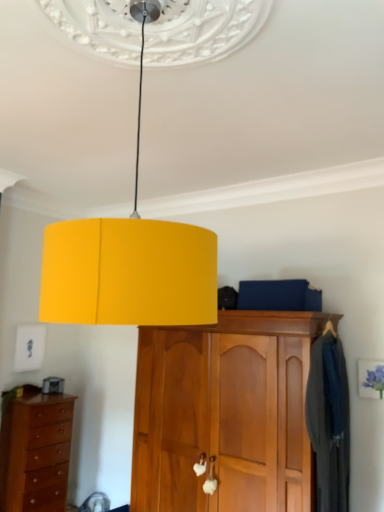
Identify the location of wooden cabinet at center. The image size is (384, 512). (225, 413).

This screenshot has height=512, width=384. Identify the location of brown wooden chest of drawers at lower left. (36, 453).

Looking at this image, which point is more forward, (338, 341) or (52, 445)?

The point (338, 341) is closer.

Is dark blue fabric coat at right oriented away from brown wooden chest of drawers at lower left?

Yes.

Is dark blue fabric coat at right wider than brown wooden chest of drawers at lower left?

No, dark blue fabric coat at right is not wider than brown wooden chest of drawers at lower left.

Consider the image. Are wooden cabinet at center and dark blue fabric coat at right beside each other?

No, wooden cabinet at center is not touching dark blue fabric coat at right.

From the image's perspective, which is above, wooden cabinet at center or dark blue fabric coat at right?

dark blue fabric coat at right.

Identify the location of cabinetry that is on the left side of dark blue fabric coat at right. The height and width of the screenshot is (512, 384). (225, 413).

Does wooden cabinet at center have a greater height compared to dark blue fabric coat at right?

Yes, wooden cabinet at center is taller than dark blue fabric coat at right.

Is wooden cabinet at center further to camera compared to brown wooden chest of drawers at lower left?

No.

Is wooden cabinet at center to the left of brown wooden chest of drawers at lower left from the viewer's perspective?

In fact, wooden cabinet at center is to the right of brown wooden chest of drawers at lower left.

Where is `chest of drawers on the left side of wooden cabinet at center`? The width and height of the screenshot is (384, 512). chest of drawers on the left side of wooden cabinet at center is located at coordinates (36, 453).

From a real-world perspective, is wooden cabinet at center over brown wooden chest of drawers at lower left?

Yes, from a real-world perspective, wooden cabinet at center is above brown wooden chest of drawers at lower left.

Can you confirm if yellow matte lampshade at center is wider than brown wooden chest of drawers at lower left?

Yes, yellow matte lampshade at center is wider than brown wooden chest of drawers at lower left.

Identify the location of the chest of drawers that is under the yellow matte lampshade at center (from a real-world perspective). (36, 453).

Does yellow matte lampshade at center lie behind brown wooden chest of drawers at lower left?

No, it is not.

Considering the points (88, 263) and (279, 390), which point is in front, point (88, 263) or point (279, 390)?

Point (88, 263)

At what (x,y) coordinates should I click in order to perform the action: click on lamp located above the wooden cabinet at center (from a real-world perspective). Please return your answer as a coordinate pair (x, y). The height and width of the screenshot is (512, 384). Looking at the image, I should click on (129, 265).

Is yellow matte lampshade at center wider or thinner than wooden cabinet at center?

In the image, yellow matte lampshade at center appears to be wider than wooden cabinet at center.

Considering the positions of objects yellow matte lampshade at center and wooden cabinet at center in the image provided, who is more to the left, yellow matte lampshade at center or wooden cabinet at center?

From the viewer's perspective, yellow matte lampshade at center appears more on the left side.

Is brown wooden chest of drawers at lower left situated inside yellow matte lampshade at center or outside?

The correct answer is: outside.

Is brown wooden chest of drawers at lower left touching yellow matte lampshade at center?

brown wooden chest of drawers at lower left is not next to yellow matte lampshade at center, and they're not touching.

Between brown wooden chest of drawers at lower left and yellow matte lampshade at center, which one has larger width?

yellow matte lampshade at center is wider.

Does point (29, 433) lie behind point (94, 301)?

That is True.

How far apart are brown wooden chest of drawers at lower left and dark blue fabric coat at right?

The distance of brown wooden chest of drawers at lower left from dark blue fabric coat at right is 7.59 feet.

Would you say dark blue fabric coat at right is part of brown wooden chest of drawers at lower left's contents?

No, dark blue fabric coat at right is not surrounded by brown wooden chest of drawers at lower left.

Considering the sizes of objects brown wooden chest of drawers at lower left and dark blue fabric coat at right in the image provided, who is taller, brown wooden chest of drawers at lower left or dark blue fabric coat at right?

Standing taller between the two is dark blue fabric coat at right.

Is there a large distance between brown wooden chest of drawers at lower left and dark blue fabric coat at right?

Absolutely, brown wooden chest of drawers at lower left is distant from dark blue fabric coat at right.

Identify the location of chest of drawers behind the dark blue fabric coat at right. This screenshot has width=384, height=512. (36, 453).

Where is `cabinetry on the left of dark blue fabric coat at right`? cabinetry on the left of dark blue fabric coat at right is located at coordinates (225, 413).

Which object lies nearer to the anchor point dark blue fabric coat at right, brown wooden chest of drawers at lower left or wooden cabinet at center?

wooden cabinet at center is positioned closer to the anchor dark blue fabric coat at right.

Considering their positions, is brown wooden chest of drawers at lower left positioned further to dark blue fabric coat at right than yellow matte lampshade at center?

brown wooden chest of drawers at lower left.

Based on their spatial positions, is wooden cabinet at center or dark blue fabric coat at right further from yellow matte lampshade at center?

wooden cabinet at center.

When comparing their distances from wooden cabinet at center, does dark blue fabric coat at right or yellow matte lampshade at center seem further?

yellow matte lampshade at center.

Looking at the image, which one is located further to dark blue fabric coat at right, wooden cabinet at center or yellow matte lampshade at center?

yellow matte lampshade at center is positioned further to the anchor dark blue fabric coat at right.

From the image, which object appears to be nearer to yellow matte lampshade at center, brown wooden chest of drawers at lower left or wooden cabinet at center?

wooden cabinet at center lies closer to yellow matte lampshade at center than the other object.

Based on their spatial positions, is brown wooden chest of drawers at lower left or dark blue fabric coat at right further from yellow matte lampshade at center?

Based on the image, brown wooden chest of drawers at lower left appears to be further to yellow matte lampshade at center.

Looking at the image, which one is located further to yellow matte lampshade at center, wooden cabinet at center or brown wooden chest of drawers at lower left?

The object further to yellow matte lampshade at center is brown wooden chest of drawers at lower left.

Image resolution: width=384 pixels, height=512 pixels. I want to click on cabinetry located between yellow matte lampshade at center and dark blue fabric coat at right in the depth direction, so coord(225,413).

What are the coordinates of `clothing located between yellow matte lampshade at center and brown wooden chest of drawers at lower left in the depth direction` in the screenshot? It's located at (329, 422).

The width and height of the screenshot is (384, 512). I want to click on cabinetry between yellow matte lampshade at center and brown wooden chest of drawers at lower left along the z-axis, so click(x=225, y=413).

Locate an element on the screen. The height and width of the screenshot is (512, 384). cabinetry between brown wooden chest of drawers at lower left and dark blue fabric coat at right from left to right is located at coordinates tap(225, 413).